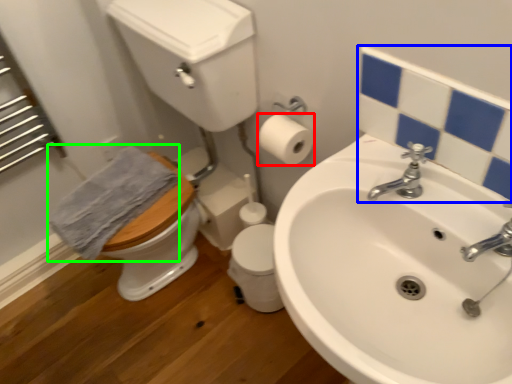
Question: Considering the real-world distances, which object is closest to toilet paper (highlighted by a red box)? mirror (highlighted by a blue box) or bath towel (highlighted by a green box).

Choices:
 (A) mirror
 (B) bath towel

Answer: (A)